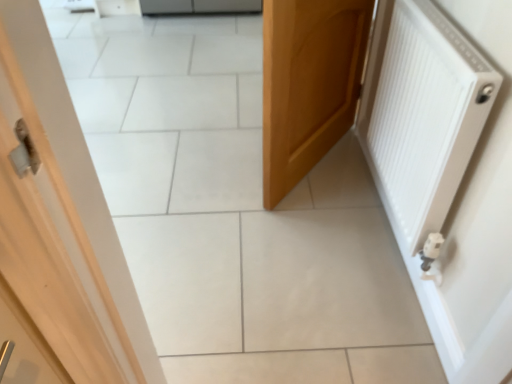
Where is `empty space that is ontop of white matte radiator at right (from a real-world perspective)`? The width and height of the screenshot is (512, 384). empty space that is ontop of white matte radiator at right (from a real-world perspective) is located at coordinates (451, 31).